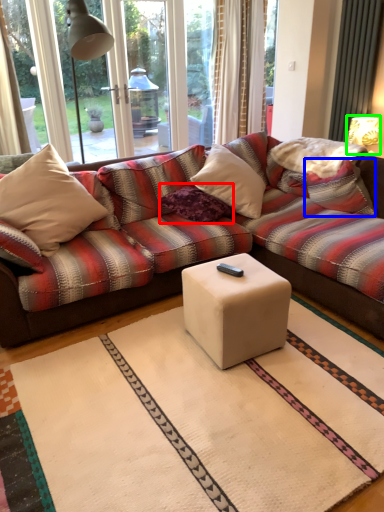
Question: Which is nearer to the pillow (highlighted by a red box)? pillow (highlighted by a blue box) or table lamp (highlighted by a green box).

Choices:
 (A) pillow
 (B) table lamp

Answer: (A)